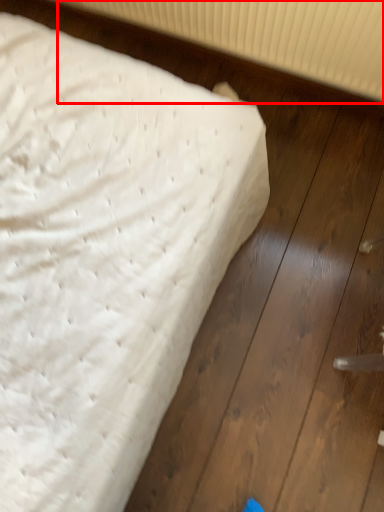
Question: In this image, where is radiator (annotated by the red box) located relative to bed?

Choices:
 (A) left
 (B) right

Answer: (B)